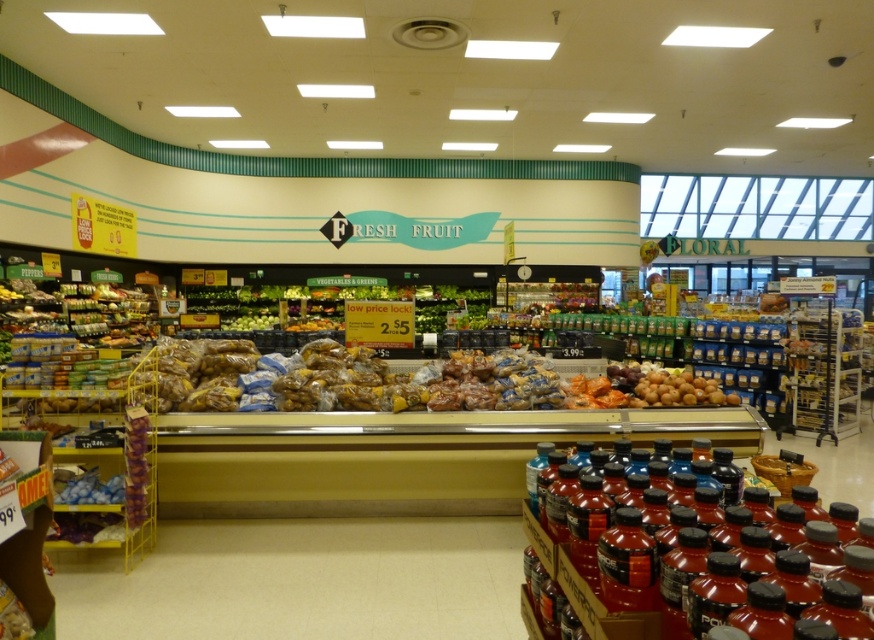
Question: Which point is closer to the camera?

Choices:
 (A) (87, 474)
 (B) (519, 372)

Answer: (A)

Question: Can you confirm if shiny plastic baguette at center is positioned to the right of shiny red plastic bottles at lower right?

Choices:
 (A) no
 (B) yes

Answer: (A)

Question: Which point is closer to the camera?

Choices:
 (A) shiny red plastic bottles at lower right
 (B) shiny plastic baguette at center
 (C) shiny blue jelly beans at lower left

Answer: (A)

Question: Can you confirm if shiny plastic baguette at center is wider than shiny blue jelly beans at lower left?

Choices:
 (A) no
 (B) yes

Answer: (B)

Question: Among these points, which one is farthest from the camera?

Choices:
 (A) pyautogui.click(x=91, y=496)
 (B) pyautogui.click(x=683, y=588)
 (C) pyautogui.click(x=525, y=355)

Answer: (C)

Question: From the image, what is the correct spatial relationship of shiny plastic baguette at center in relation to shiny blue jelly beans at lower left?

Choices:
 (A) left
 (B) right

Answer: (B)